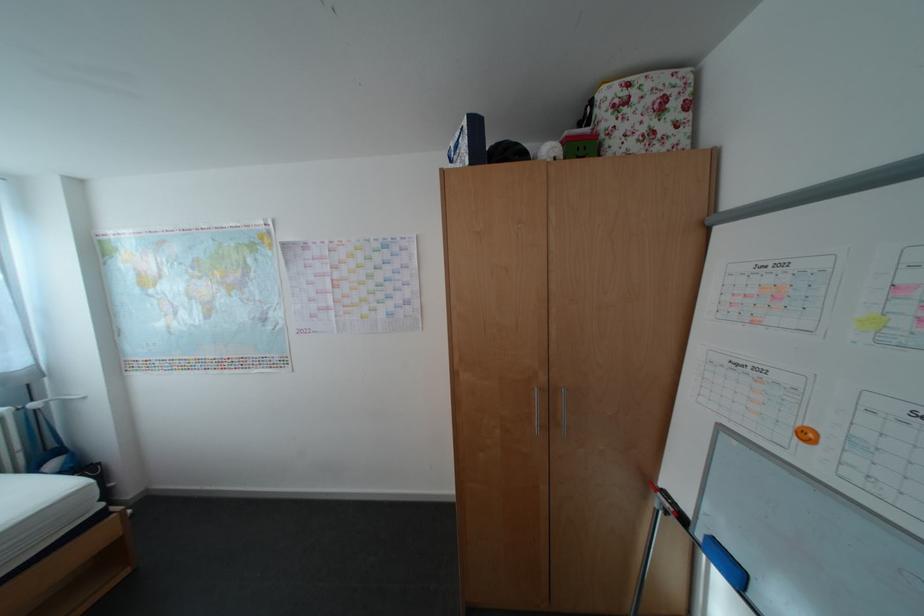
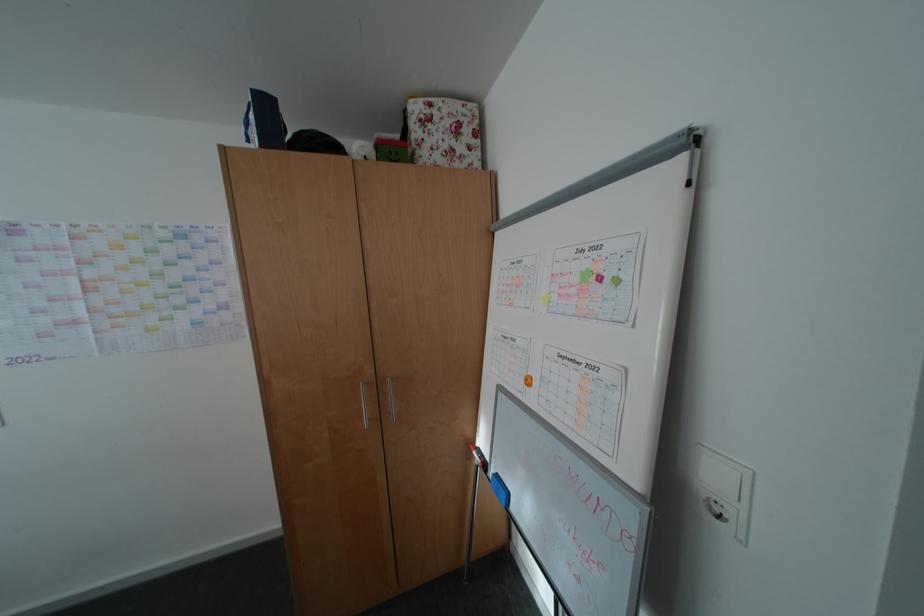
Question: Which direction would the cameraman need to move to produce the second image? Reply with the corresponding letter.

Choices:
 (A) Left
 (B) Right
 (C) Forward
 (D) Backward

Answer: (B)